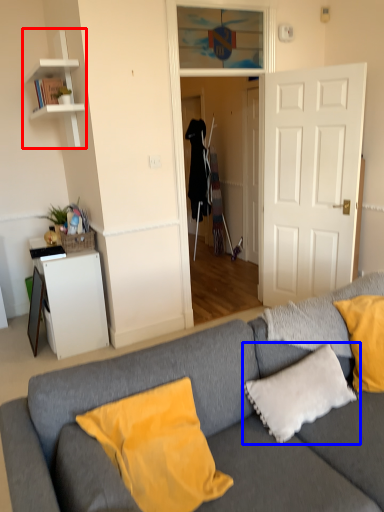
Question: Which object appears farthest to the camera in this image, shelf (highlighted by a red box) or pillow (highlighted by a blue box)?

Choices:
 (A) shelf
 (B) pillow

Answer: (A)